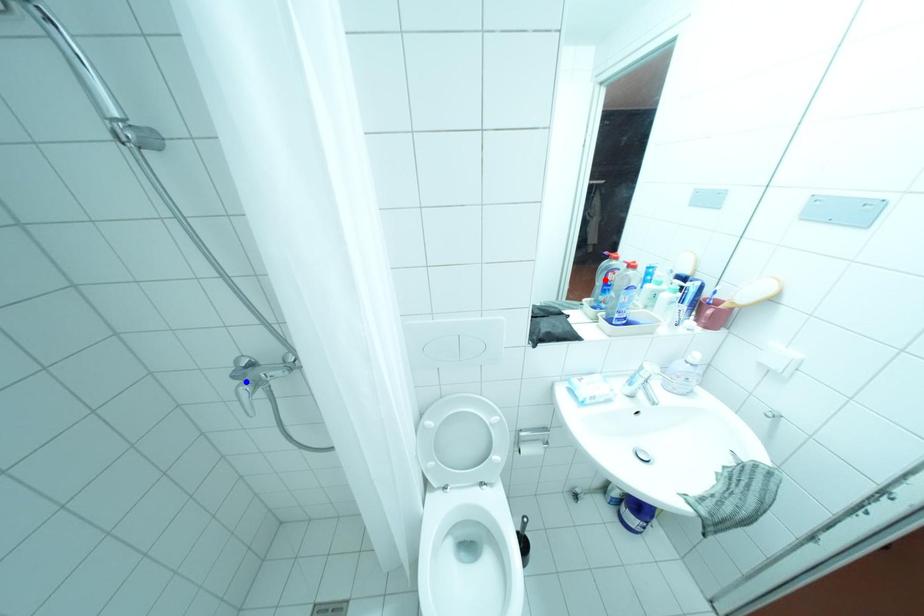
Question: Two points are marked on the image. Which point is closer to the camera?

Choices:
 (A) Blue point is closer.
 (B) Red point is closer.

Answer: (A)